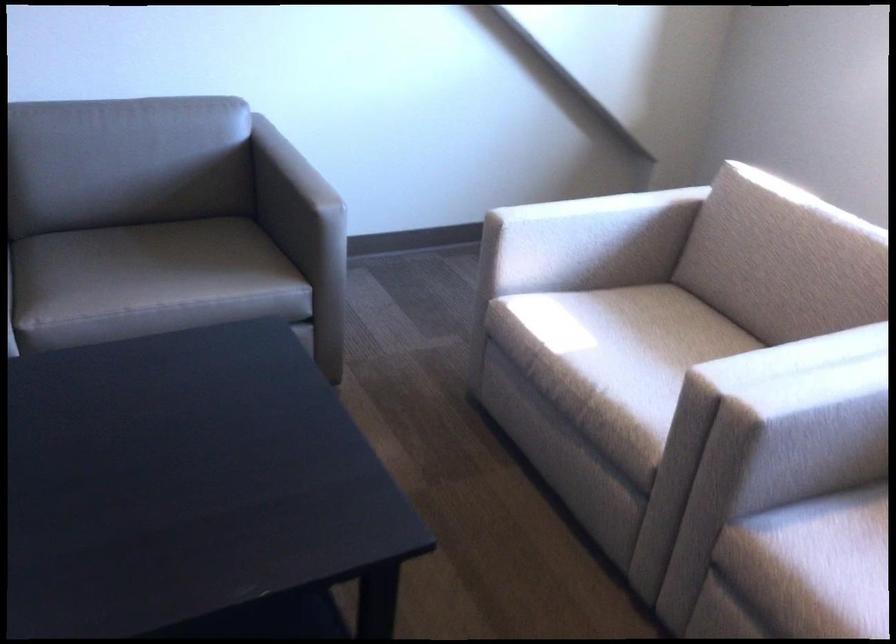
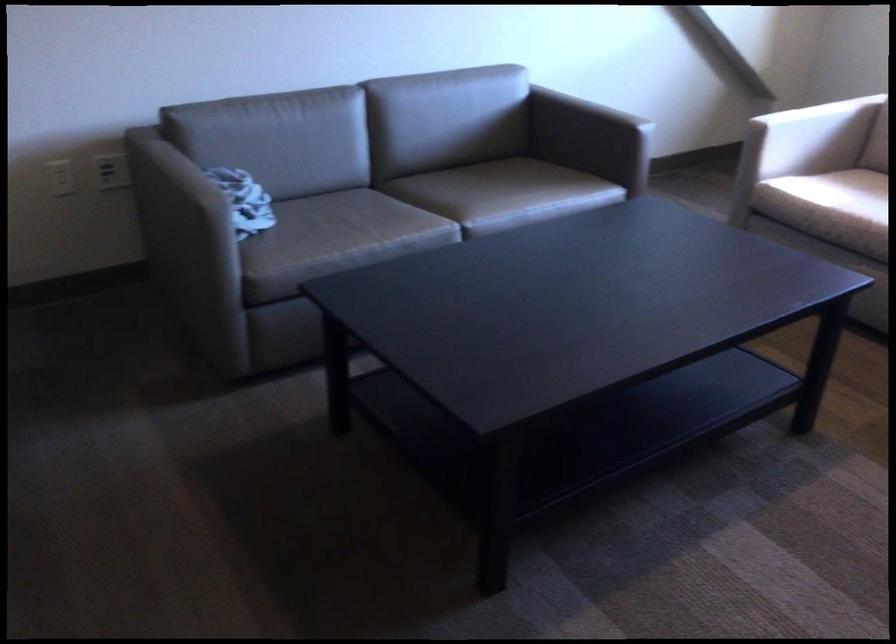
In the second image, find the point that corresponds to point 552,368 in the first image.

(821, 216)